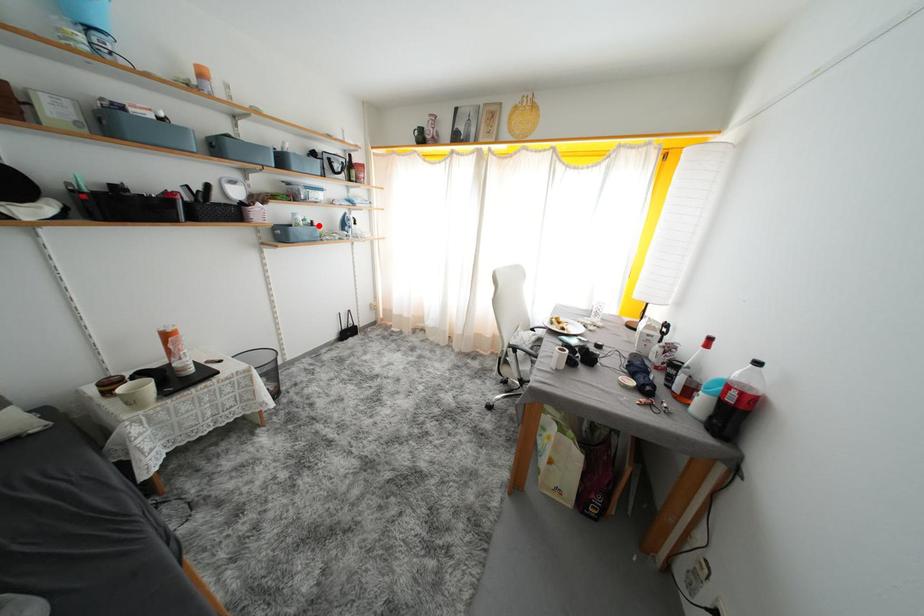
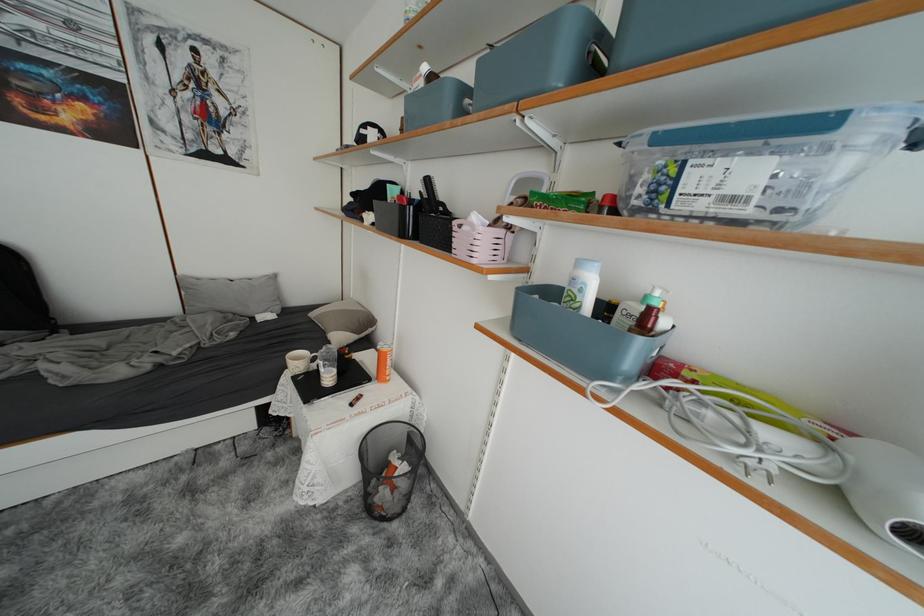
Question: I am providing you with two images of the same scene from different viewpoints. A red point is marked on the first image. Can you still see the location of the red point in image 2?

Choices:
 (A) Yes
 (B) No

Answer: (A)